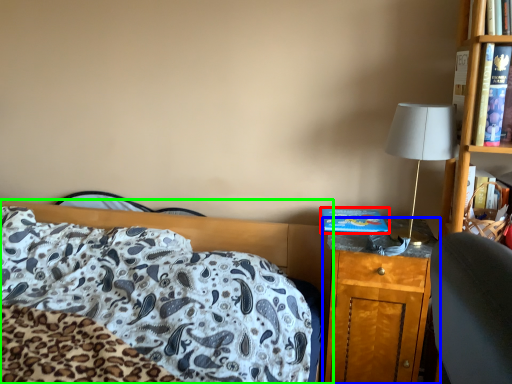
Question: Which object is the closest to the hardback book (highlighted by a red box)? Choose among these: nightstand (highlighted by a blue box) or bed (highlighted by a green box).

Choices:
 (A) nightstand
 (B) bed

Answer: (A)